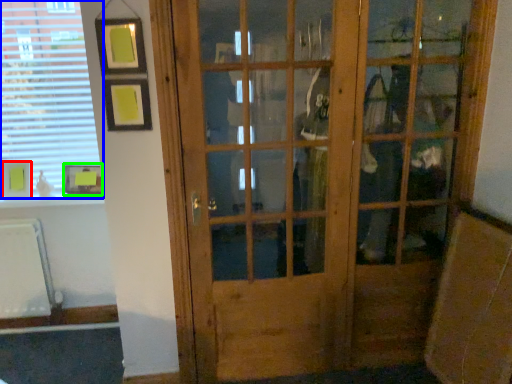
Question: Based on their relative distances, which object is nearer to picture frame (highlighted by a red box)? Choose from window (highlighted by a blue box) and picture frame (highlighted by a green box).

Choices:
 (A) window
 (B) picture frame

Answer: (B)